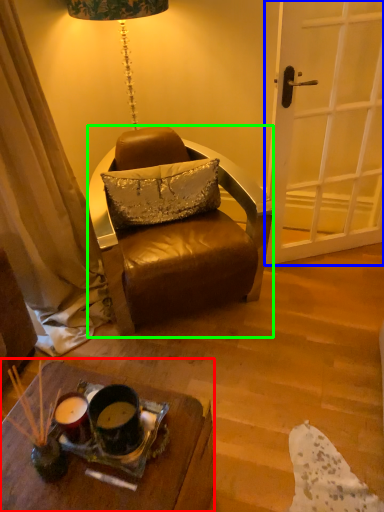
Question: Which is nearer to the desk (highlighted by a red box)? door (highlighted by a blue box) or chair (highlighted by a green box).

Choices:
 (A) door
 (B) chair

Answer: (B)